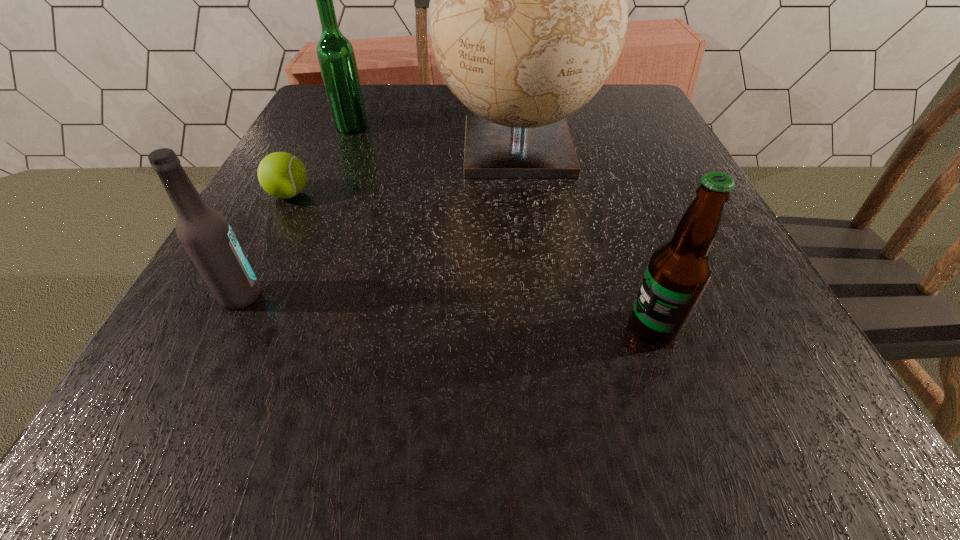
Find the location of a particular element. This screenshot has height=540, width=960. the tallest object is located at coordinates (528, 13).

Image resolution: width=960 pixels, height=540 pixels. In order to click on the farthest beer bottle in this screenshot , I will do `click(336, 57)`.

Locate an element on the screen. the rightmost beer bottle is located at coordinates (679, 271).

Where is `the shortest object`? the shortest object is located at coordinates (282, 175).

Where is `free spot located 0.210m on the surface of the globe showing Europe and Africa`? free spot located 0.210m on the surface of the globe showing Europe and Africa is located at coordinates (533, 280).

Where is `free location located 0.300m on the front of the farthest beer bottle`? free location located 0.300m on the front of the farthest beer bottle is located at coordinates (312, 221).

At what (x,y) coordinates should I click in order to perform the action: click on free location located on the label of the rightmost beer bottle. Please return your answer as a coordinate pair (x, y). Looking at the image, I should click on click(x=333, y=328).

The height and width of the screenshot is (540, 960). Find the location of `free location located on the label of the rightmost beer bottle`. free location located on the label of the rightmost beer bottle is located at coordinates (495, 328).

This screenshot has height=540, width=960. Identify the location of vacant position located 0.110m on the label of the rightmost beer bottle. [546, 328].

At what (x,y) coordinates should I click in order to perform the action: click on free region located on the back of the tennis ball. Please return your answer as a coordinate pair (x, y). Looking at the image, I should click on (332, 110).